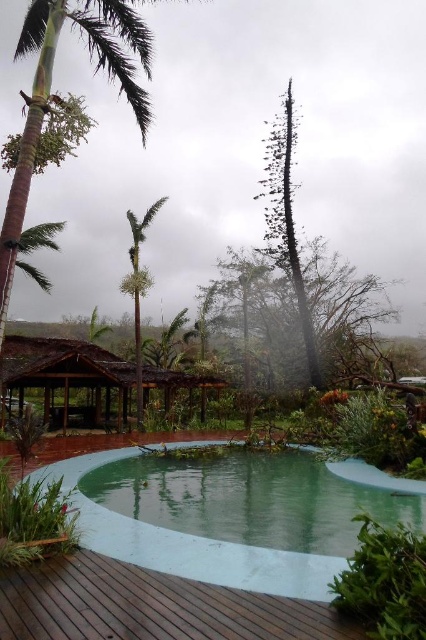
Question: From the image, what is the correct spatial relationship of green concrete pool at center in relation to green leafy palm at upper left?

Choices:
 (A) below
 (B) above

Answer: (A)

Question: Estimate the real-world distances between objects in this image. Which object is closer to the green leafy palm at upper left?

Choices:
 (A) dark green textured tree at center
 (B) green concrete pool at center
 (C) green leafy palm tree at center
 (D) brown wooden deck at lower center

Answer: (D)

Question: Estimate the real-world distances between objects in this image. Which object is farther from the dark green textured tree at center?

Choices:
 (A) brown wooden deck at lower center
 (B) green concrete pool at center
 (C) green leafy palm at upper left

Answer: (A)

Question: Among these points, which one is farthest from the camera?

Choices:
 (A) (120, 26)
 (B) (302, 282)

Answer: (B)

Question: Does brown wooden deck at lower center have a greater width compared to green leafy palm tree at center?

Choices:
 (A) no
 (B) yes

Answer: (A)

Question: From the image, what is the correct spatial relationship of green concrete pool at center in relation to green leafy palm tree at center?

Choices:
 (A) above
 (B) below

Answer: (B)